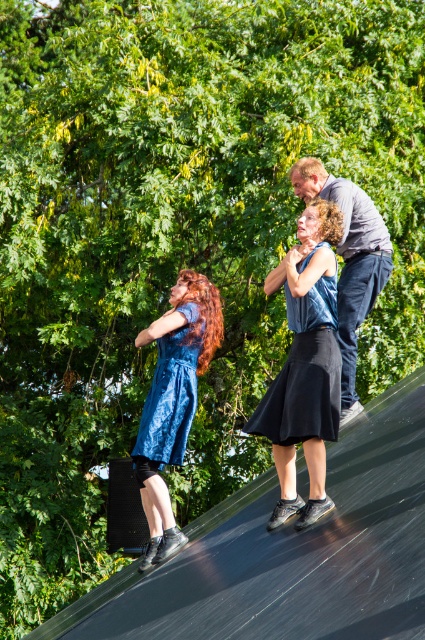
Is point (187, 403) farther from camera compared to point (314, 422)?

Yes, it is.

You are a GUI agent. You are given a task and a screenshot of the screen. Output one action in this format:
    pyautogui.click(x=<x>, y=<y>)
    Task: Click on the blue satin dress at center
    This screenshot has height=640, width=425.
    Given the screenshot: What is the action you would take?
    pyautogui.click(x=172, y=401)

Looking at this image, is black rubber ramp at upper center positioned behind blue satin dress at center?

No, black rubber ramp at upper center is closer to the viewer.

Which is behind, point (186, 525) or point (178, 461)?

The point (186, 525) is more distant.

Which is behind, point (371, 609) or point (189, 291)?

The point (189, 291) is more distant.

What are the coordinates of `black rubber ramp at upper center` in the screenshot? It's located at (289, 554).

Which of these two, blue satin dress at center or dark gray shirt at upper right, stands shorter?

Standing shorter between the two is blue satin dress at center.

What do you see at coordinates (172, 401) in the screenshot? Image resolution: width=425 pixels, height=640 pixels. I see `blue satin dress at center` at bounding box center [172, 401].

In order to click on blue satin dress at center in this screenshot , I will do `click(172, 401)`.